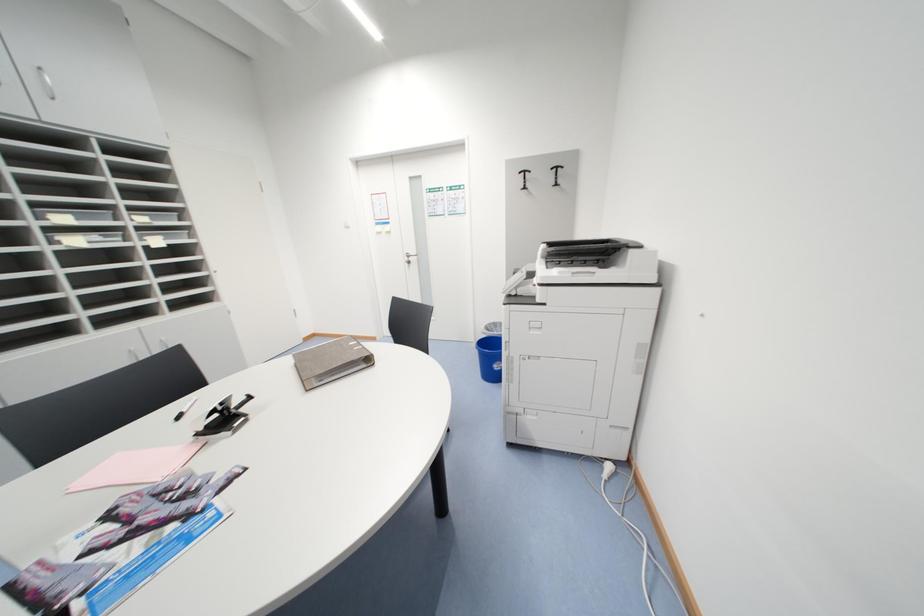
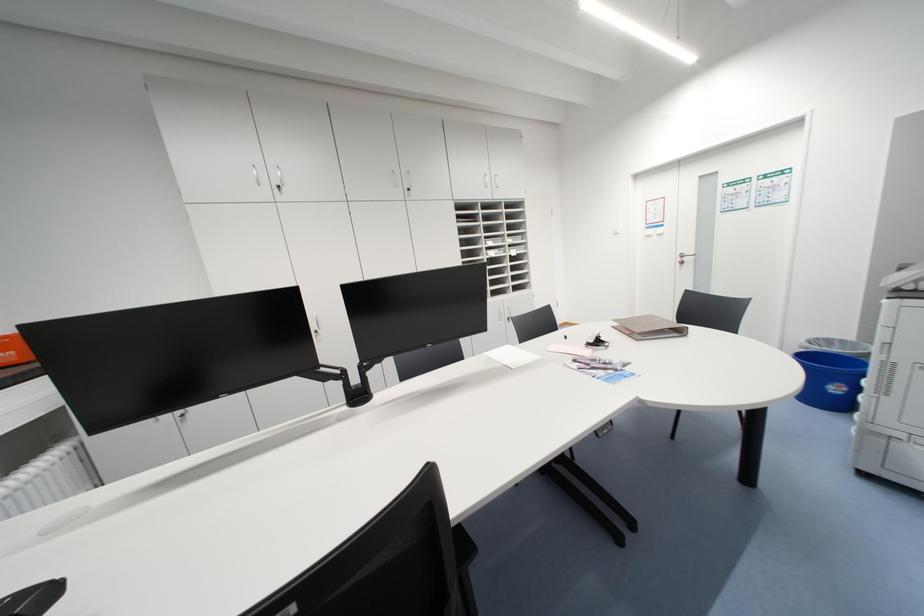
Question: The camera is either moving clockwise (left) or counter-clockwise (right) around the object. The first image is from the beginning of the video and the second image is from the end. Is the camera moving left or right when shooting the video?

Choices:
 (A) Left
 (B) Right

Answer: (B)